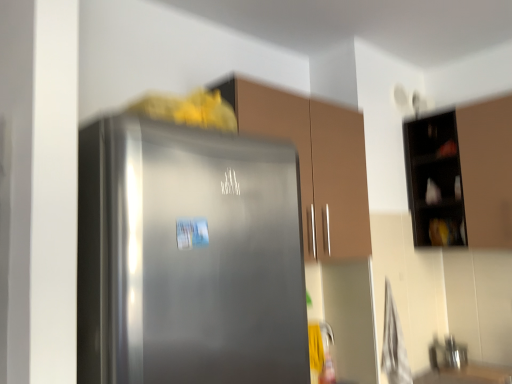
Question: Does smooth wooden counter top at lower right have a lesser height compared to metallic stainless steel sink at lower right?

Choices:
 (A) no
 (B) yes

Answer: (B)

Question: Considering the relative sizes of smooth wooden counter top at lower right and metallic stainless steel sink at lower right in the image provided, is smooth wooden counter top at lower right bigger than metallic stainless steel sink at lower right?

Choices:
 (A) yes
 (B) no

Answer: (B)

Question: From a real-world perspective, is smooth wooden counter top at lower right on top of metallic stainless steel sink at lower right?

Choices:
 (A) yes
 (B) no

Answer: (B)

Question: From the image's perspective, is smooth wooden counter top at lower right above metallic stainless steel sink at lower right?

Choices:
 (A) yes
 (B) no

Answer: (B)

Question: Is the position of smooth wooden counter top at lower right more distant than that of metallic stainless steel sink at lower right?

Choices:
 (A) no
 (B) yes

Answer: (A)

Question: Visually, is metallic stainless steel sink at lower right positioned to the left or to the right of black matte cabinet at upper right, which is the 1th cabinetry from right to left?

Choices:
 (A) left
 (B) right

Answer: (A)

Question: Is metallic stainless steel sink at lower right situated inside black matte cabinet at upper right, which appears as the 2th cabinetry when viewed from the left, or outside?

Choices:
 (A) outside
 (B) inside

Answer: (A)

Question: Considering their positions, is metallic stainless steel sink at lower right located in front of or behind black matte cabinet at upper right, which is the 1th cabinetry from right to left?

Choices:
 (A) behind
 (B) front

Answer: (A)

Question: Considering the positions of point (445, 340) and point (446, 188), is point (445, 340) closer or farther from the camera than point (446, 188)?

Choices:
 (A) closer
 (B) farther

Answer: (A)

Question: Is smooth wooden counter top at lower right in front of or behind metallic stainless steel sink at lower right in the image?

Choices:
 (A) behind
 (B) front

Answer: (B)

Question: Does point (482, 372) appear closer or farther from the camera than point (443, 364)?

Choices:
 (A) closer
 (B) farther

Answer: (A)

Question: From a real-world perspective, is smooth wooden counter top at lower right positioned above or below metallic stainless steel sink at lower right?

Choices:
 (A) above
 (B) below

Answer: (B)

Question: Would you say smooth wooden counter top at lower right is to the left or to the right of metallic stainless steel sink at lower right in the picture?

Choices:
 (A) left
 (B) right

Answer: (B)

Question: Looking at their shapes, would you say matte brown cabinet at center, the second cabinetry when ordered from right to left, is wider or thinner than black matte cabinet at upper right, which appears as the 2th cabinetry when viewed from the left?

Choices:
 (A) thin
 (B) wide

Answer: (B)

Question: From a real-world perspective, relative to black matte cabinet at upper right, which appears as the 2th cabinetry when viewed from the left, is matte brown cabinet at center, the first cabinetry positioned from the left, vertically above or below?

Choices:
 (A) above
 (B) below

Answer: (B)